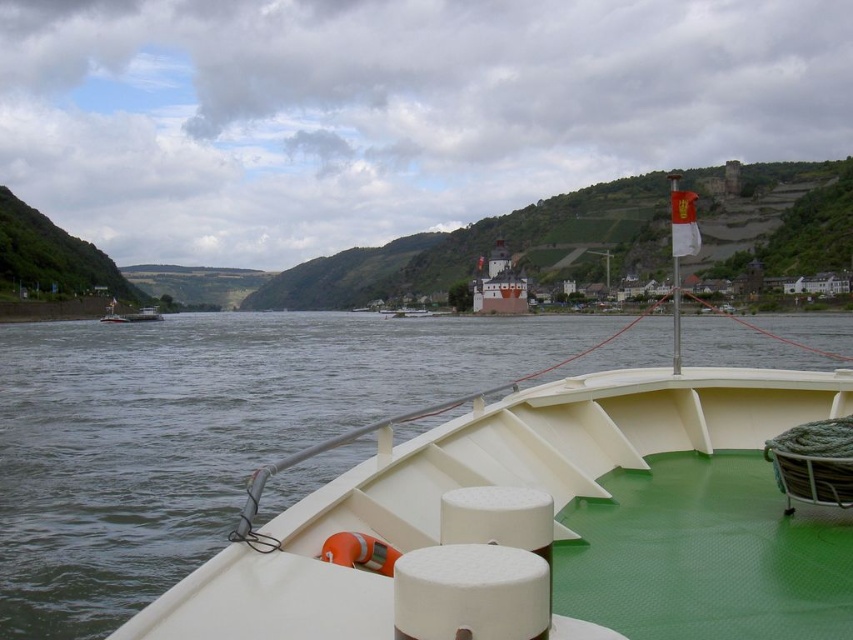
Does point (325, 403) come behind point (518, 310)?

No, (325, 403) is in front of (518, 310).

Does green rubber water at center come in front of white matte castle at center?

Yes.

Describe the element at coordinates (195, 433) in the screenshot. This screenshot has width=853, height=640. I see `green rubber water at center` at that location.

You are a GUI agent. You are given a task and a screenshot of the screen. Output one action in this format:
    pyautogui.click(x=<x>, y=<y>)
    Task: Click on the green rubber water at center
    This screenshot has height=640, width=853.
    Given the screenshot: What is the action you would take?
    [195, 433]